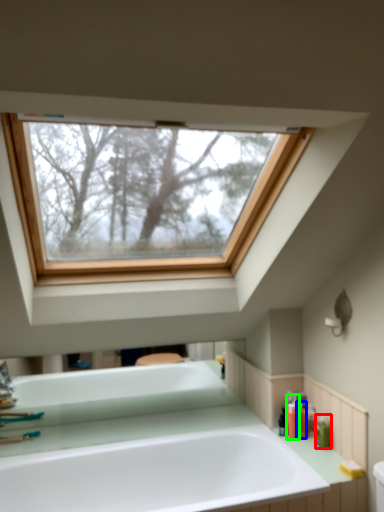
Question: Which object is the farthest from toiletry (highlighted by a red box)? Choose among these: toiletry (highlighted by a blue box) or toiletry (highlighted by a green box).

Choices:
 (A) toiletry
 (B) toiletry

Answer: (B)